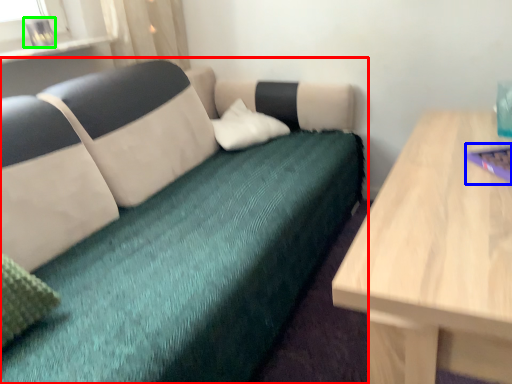
Question: Which is farther away from studio couch (highlighted by a red box)? laptop (highlighted by a blue box) or glass vase (highlighted by a green box)?

Choices:
 (A) laptop
 (B) glass vase

Answer: (A)